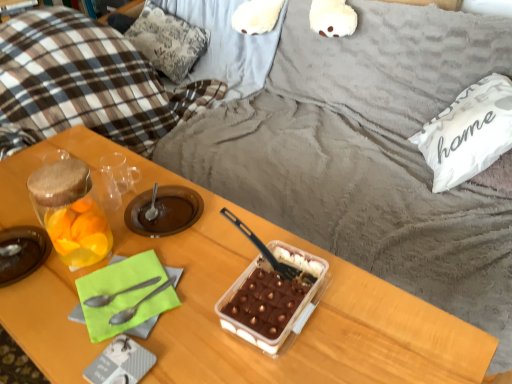
Locate an element on the screen. This screenshot has height=384, width=512. empty space that is ontop of wooden table at center (from a real-world perspective) is located at coordinates (164, 255).